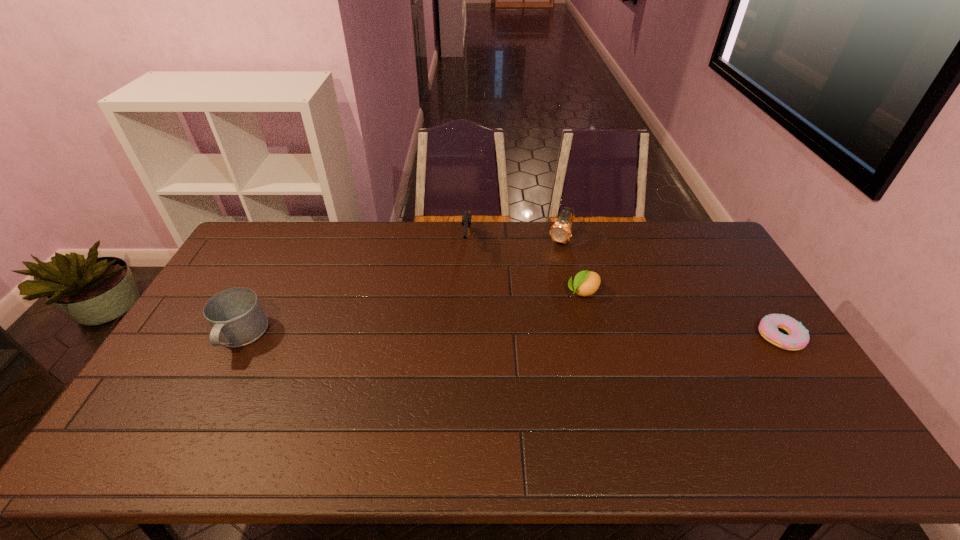
Where is `object at the left edge`? object at the left edge is located at coordinates (236, 317).

Identify the location of object that is at the right edge. The image size is (960, 540). (798, 338).

In the image, there is a desktop. Where is `vacant space at the far edge`? vacant space at the far edge is located at coordinates (650, 224).

This screenshot has width=960, height=540. In the image, there is a desktop. Find the location of `blank space at the near edge`. blank space at the near edge is located at coordinates (509, 400).

In the image, there is a desktop. What are the coordinates of `vacant area at the left edge` in the screenshot? It's located at (201, 320).

Locate an element on the screen. vacant space at the far left corner of the desktop is located at coordinates (291, 222).

At what (x,y) coordinates should I click in order to perform the action: click on free space that is in between the watch and the gun. Please return your answer as a coordinate pair (x, y). The height and width of the screenshot is (540, 960). Looking at the image, I should click on (514, 243).

The width and height of the screenshot is (960, 540). I want to click on unoccupied area between the doughnut and the fourth object from right to left, so (x=623, y=291).

Identify the location of vacant space that is in between the rightmost object and the leftmost object. The image size is (960, 540). (510, 336).

This screenshot has width=960, height=540. Find the location of `empty space between the second shortest object and the leftmost object`. empty space between the second shortest object and the leftmost object is located at coordinates 412,314.